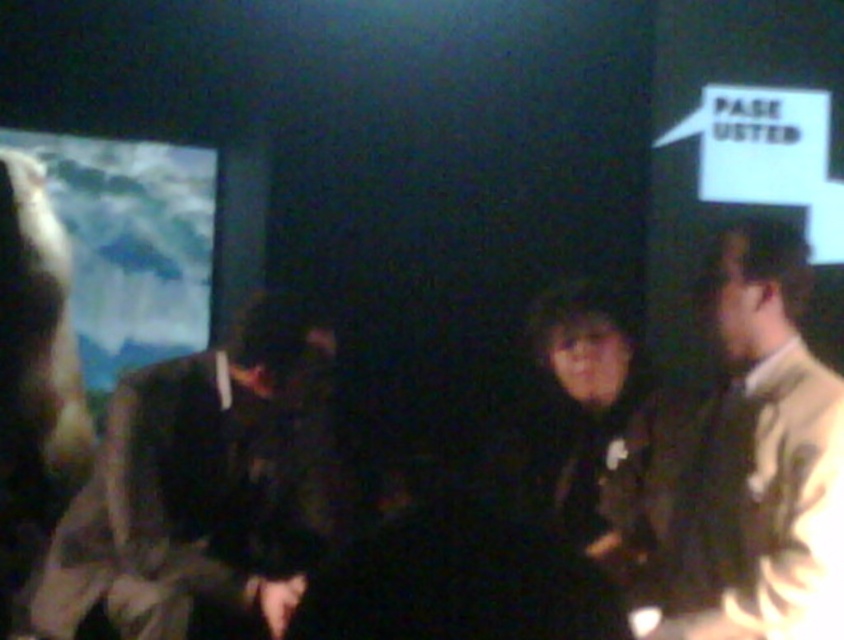
Question: Which point is closer to the camera?

Choices:
 (A) click(x=247, y=324)
 (B) click(x=812, y=620)

Answer: (B)

Question: Does dark brown suit at left have a smaller size compared to light beige jacket at right?

Choices:
 (A) yes
 (B) no

Answer: (B)

Question: Which point appears closest to the camera in this image?

Choices:
 (A) (801, 477)
 (B) (311, 564)

Answer: (A)

Question: Is dark brown suit at left to the left of light beige jacket at right from the viewer's perspective?

Choices:
 (A) no
 (B) yes

Answer: (B)

Question: Is the position of dark brown suit at left more distant than that of light beige jacket at right?

Choices:
 (A) yes
 (B) no

Answer: (A)

Question: Among these objects, which one is nearest to the camera?

Choices:
 (A) light beige jacket at right
 (B) dark brown suit at left

Answer: (A)